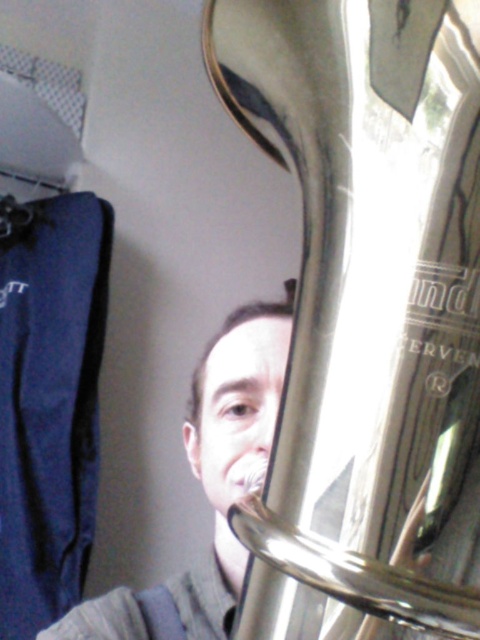
You are a photographer positioned 12 inches away from a polished silver trumpet at center. Can you take a clear photo of it without moving your camera?

The polished silver trumpet at center is 11.18 inches away from the viewer, so yes, you can take a clear photo without moving your camera since the distance is within the 12 inches range.

You are a photographer setting up a shoot in the studio. You have two instruments, a polished silver trumpet at center and a matte silver tuba at center. You want to position them so that the taller instrument is placed behind the shorter one. Which instrument should you place in the back?

The matte silver tuba at center is taller than the polished silver trumpet at center, so you should place the matte silver tuba at center in the back.